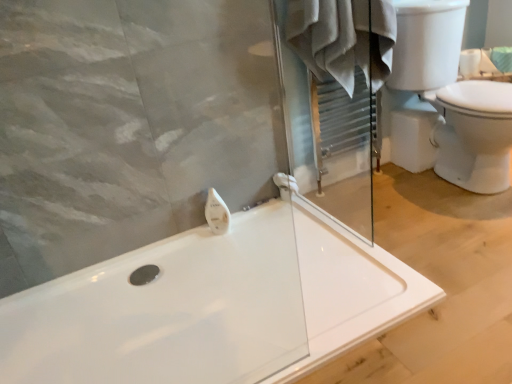
Locate an element on the screen. vacant area on top of white glossy bathtub at center (from a real-world perspective) is located at coordinates (284, 287).